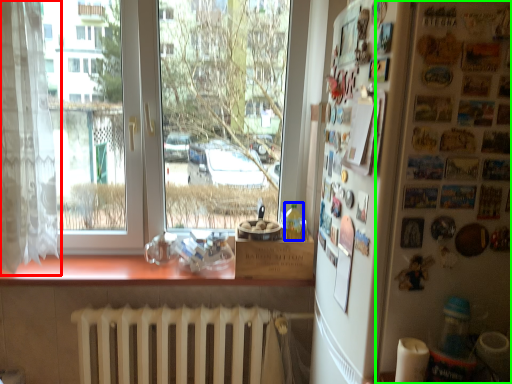
Question: Based on their relative distances, which object is nearer to curtain (highlighted by a red box)? Choose from bottle (highlighted by a blue box) and bulletin board (highlighted by a green box).

Choices:
 (A) bottle
 (B) bulletin board

Answer: (A)